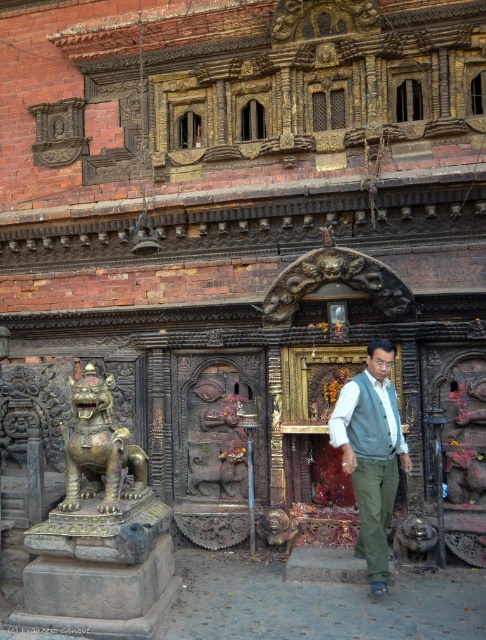
You are an architect assessing the symmetry of the temple facade. You notice the gold polished lion at left and the white matte shirt at center. Which object is narrower in width?

The gold polished lion at left has a lesser width compared to the white matte shirt at center, so the gold polished lion at left is narrower.

You are a tailor examining a customer standing in front of you. The customer is wearing both the light blue fabric vest at center and the white matte shirt at center. To adjust the fit of the vest, you need to know its position relative to the shirt. Is the vest positioned to the right or left of the shirt?

The light blue fabric vest at center is to the right of the white matte shirt at center, so the vest is positioned to the right of the shirt.

You are an artist observing the temple facade and want to paint the two objects in the scene. Which object is taller between the light blue fabric vest at center and the gold polished lion at left?

The light blue fabric vest at center is taller than the gold polished lion at left.